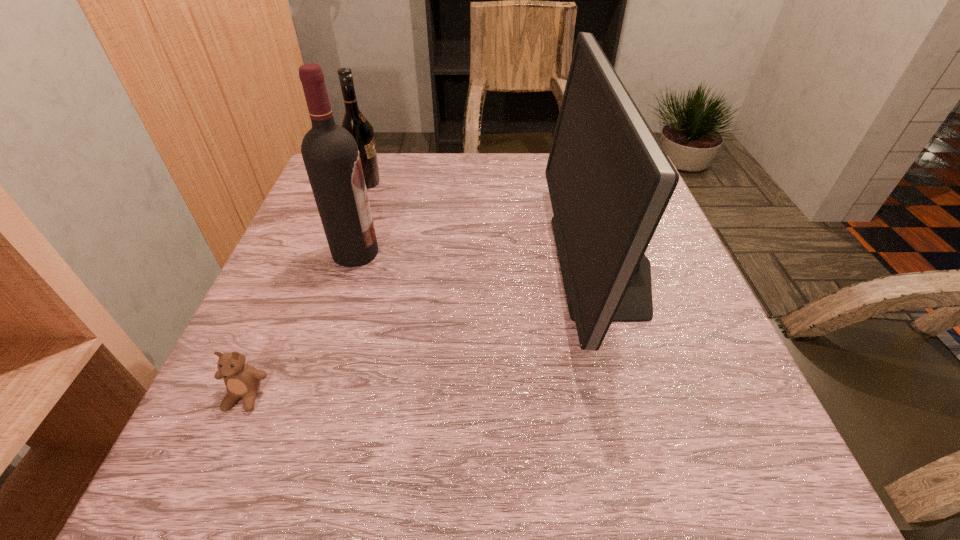
Locate an element on the screen. The height and width of the screenshot is (540, 960). free space that is in between the taller wine bottle and the nearest object is located at coordinates (300, 325).

At what (x,y) coordinates should I click in order to perform the action: click on vacant space in between the farthest object and the rightmost object. Please return your answer as a coordinate pair (x, y). Looking at the image, I should click on (485, 223).

Point out which object is positioned as the third nearest to the taller wine bottle. Please provide its 2D coordinates. Your answer should be formatted as a tuple, i.e. [(x, y)], where the tuple contains the x and y coordinates of a point satisfying the conditions above.

[(609, 180)]

Identify which object is located as the nearest to the farther wine bottle. Please provide its 2D coordinates. Your answer should be formatted as a tuple, i.e. [(x, y)], where the tuple contains the x and y coordinates of a point satisfying the conditions above.

[(330, 153)]

Locate an element on the screen. Image resolution: width=960 pixels, height=540 pixels. vacant region that satisfies the following two spatial constraints: 1. on the label of the nearer wine bottle; 2. on the front-facing side of the shortest object is located at coordinates point(311,396).

The image size is (960, 540). Identify the location of vacant space that satisfies the following two spatial constraints: 1. on the label of the nearer wine bottle; 2. on the front-facing side of the shortest object. (311, 396).

Where is `blank area in the image that satisfies the following two spatial constraints: 1. on the label of the farther wine bottle; 2. on the front-facing side of the teddy bear`? This screenshot has width=960, height=540. blank area in the image that satisfies the following two spatial constraints: 1. on the label of the farther wine bottle; 2. on the front-facing side of the teddy bear is located at coordinates (294, 396).

Identify the location of free point that satisfies the following two spatial constraints: 1. on the label of the taller wine bottle; 2. on the front-facing side of the nearest object. (311, 396).

I want to click on vacant area in the image that satisfies the following two spatial constraints: 1. on the label of the farthest object; 2. on the front-facing side of the teddy bear, so click(294, 396).